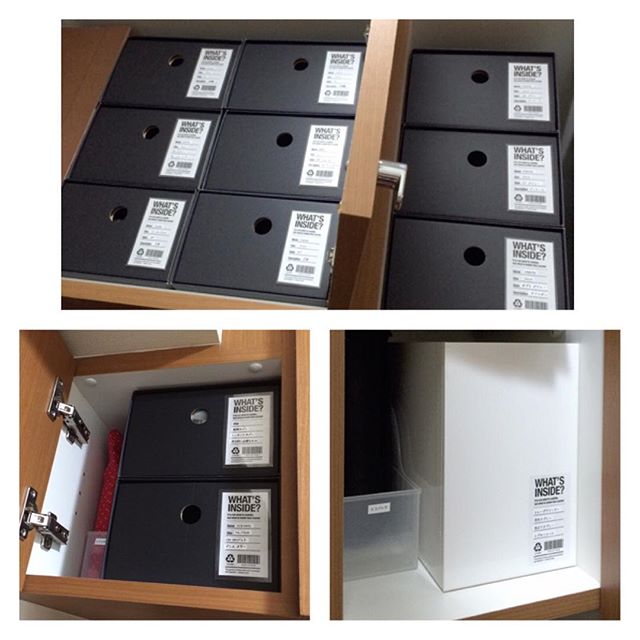
Identify the location of black drawers. (179, 433), (230, 534), (278, 150), (155, 189), (157, 230), (518, 242), (516, 221).